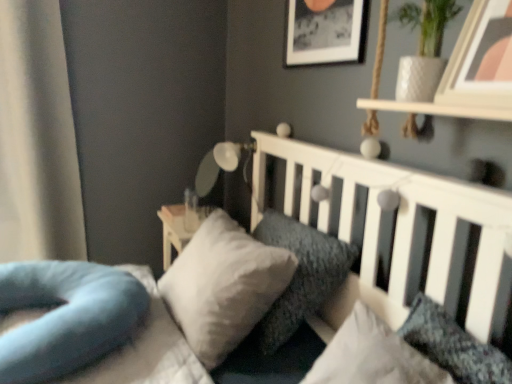
What is the approximate width of white soft bed at center?

The width of white soft bed at center is 1.18 meters.

Image resolution: width=512 pixels, height=384 pixels. What do you see at coordinates (400, 231) in the screenshot?
I see `white soft bed at center` at bounding box center [400, 231].

Consider the image. How much space does black matte picture frame at upper center, the second picture frame in the bottom-to-top sequence, occupy vertically?

black matte picture frame at upper center, the second picture frame in the bottom-to-top sequence, is 11.04 inches in height.

At what (x,y) coordinates should I click in order to perform the action: click on wooden picture frame at upper right, arranged as the second picture frame when viewed from the top. Please return your answer as a coordinate pair (x, y). The height and width of the screenshot is (384, 512). Looking at the image, I should click on (481, 59).

In order to click on textured gray pillow at center, the 4th pillow from the left in this screenshot , I will do `click(372, 356)`.

Describe the element at coordinates (372, 356) in the screenshot. I see `textured gray pillow at center, the 4th pillow from the left` at that location.

This screenshot has width=512, height=384. Identify the location of soft blue pillow at lower left, which appears as the first pillow when viewed from the left. (66, 316).

Where is `white soft bed at center`? Image resolution: width=512 pixels, height=384 pixels. white soft bed at center is located at coordinates (400, 231).

Considering the sizes of wooden picture frame at upper right, which is the 1th picture frame in right-to-left order, and soft blue pillow at lower left, the 4th pillow viewed from the right, in the image, is wooden picture frame at upper right, which is the 1th picture frame in right-to-left order, wider or thinner than soft blue pillow at lower left, the 4th pillow viewed from the right,?

Clearly, wooden picture frame at upper right, which is the 1th picture frame in right-to-left order, has less width compared to soft blue pillow at lower left, the 4th pillow viewed from the right.

Is wooden picture frame at upper right, arranged as the second picture frame when viewed from the top, closer to the viewer compared to soft blue pillow at lower left, the 4th pillow viewed from the right?

Yes, wooden picture frame at upper right, arranged as the second picture frame when viewed from the top, is in front of soft blue pillow at lower left, the 4th pillow viewed from the right.

How different are the orientations of wooden picture frame at upper right, which appears as the second picture frame when viewed from the back, and soft blue pillow at lower left, which appears as the first pillow when viewed from the left, in degrees?

They differ by 1.51 degrees in their facing directions.

From their relative heights in the image, would you say wooden picture frame at upper right, marked as the second picture frame in a left-to-right arrangement, is taller or shorter than soft blue pillow at lower left, which appears as the first pillow when viewed from the left?

Clearly, wooden picture frame at upper right, marked as the second picture frame in a left-to-right arrangement, is taller compared to soft blue pillow at lower left, which appears as the first pillow when viewed from the left.

Is white soft pillow at center, the second pillow positioned from the left, next to white glossy lamp at upper center and touching it?

No.

From a real-world perspective, between white soft pillow at center, the second pillow positioned from the left, and white glossy lamp at upper center, who is vertically lower?

white soft pillow at center, the second pillow positioned from the left, from a real-world perspective.

Can you confirm if white glossy lamp at upper center is smaller than white soft pillow at center, which appears as the third pillow when viewed from the right?

Yes.

What's the angular difference between white glossy lamp at upper center and white soft pillow at center, which appears as the third pillow when viewed from the right,'s facing directions?

There is a 1.92-degree angle between the facing directions of white glossy lamp at upper center and white soft pillow at center, which appears as the third pillow when viewed from the right.

Does point (222, 162) appear closer or farther from the camera than point (231, 318)?

Point (222, 162) is farther from the camera than point (231, 318).

Could you tell me if white glossy lamp at upper center is turned towards white soft pillow at center, which appears as the third pillow when viewed from the right?

No.

Would you say wooden picture frame at upper right, arranged as the second picture frame when viewed from the top, is part of textured gray pillow at center, the 4th pillow from the left,'s contents?

No, wooden picture frame at upper right, arranged as the second picture frame when viewed from the top, is located outside of textured gray pillow at center, the 4th pillow from the left.

How different are the orientations of textured gray pillow at center, the 4th pillow from the left, and wooden picture frame at upper right, the 1th picture frame when ordered from bottom to top, in degrees?

The facing directions of textured gray pillow at center, the 4th pillow from the left, and wooden picture frame at upper right, the 1th picture frame when ordered from bottom to top, are 2.97 degrees apart.

Consider the image. Which object is further away from the camera, textured gray pillow at center, positioned as the 1th pillow in right-to-left order, or wooden picture frame at upper right, which appears as the second picture frame when viewed from the back?

wooden picture frame at upper right, which appears as the second picture frame when viewed from the back, is further from the camera.

In terms of height, does textured gray pillow at center, positioned as the 1th pillow in right-to-left order, look taller or shorter compared to wooden picture frame at upper right, arranged as the second picture frame when viewed from the top?

In the image, textured gray pillow at center, positioned as the 1th pillow in right-to-left order, appears to be taller than wooden picture frame at upper right, arranged as the second picture frame when viewed from the top.

The height and width of the screenshot is (384, 512). What are the coordinates of `the 1st picture frame to the right of the soft gray pillow at center, which is counted as the 2th pillow, starting from the right, starting your count from the anchor` in the screenshot? It's located at (324, 31).

Is black matte picture frame at upper center, which is the first picture frame from back to front, with soft gray pillow at center, arranged as the 3th pillow when viewed from the left?

No, black matte picture frame at upper center, which is the first picture frame from back to front, is not touching soft gray pillow at center, arranged as the 3th pillow when viewed from the left.

Looking at this image, does black matte picture frame at upper center, the first picture frame positioned from the top, have a greater width compared to soft gray pillow at center, arranged as the 3th pillow when viewed from the left?

Incorrect, the width of black matte picture frame at upper center, the first picture frame positioned from the top, does not surpass that of soft gray pillow at center, arranged as the 3th pillow when viewed from the left.

Can you confirm if white soft pillow at center, which appears as the third pillow when viewed from the right, is thinner than soft blue pillow at lower left, which appears as the first pillow when viewed from the left?

Yes.

Considering the sizes of objects white soft pillow at center, the second pillow positioned from the left, and soft blue pillow at lower left, which appears as the first pillow when viewed from the left, in the image provided, who is bigger, white soft pillow at center, the second pillow positioned from the left, or soft blue pillow at lower left, which appears as the first pillow when viewed from the left,?

Bigger between the two is white soft pillow at center, the second pillow positioned from the left.

From a real-world perspective, is white soft pillow at center, which appears as the third pillow when viewed from the right, located beneath soft blue pillow at lower left, which appears as the first pillow when viewed from the left?

No, from a real-world perspective, white soft pillow at center, which appears as the third pillow when viewed from the right, is not below soft blue pillow at lower left, which appears as the first pillow when viewed from the left.

From the image's perspective, who appears lower, white soft pillow at center, the second pillow positioned from the left, or soft blue pillow at lower left, the 4th pillow viewed from the right?

soft blue pillow at lower left, the 4th pillow viewed from the right, is shown below in the image.

Is white glossy lamp at upper center aimed at wooden picture frame at upper right, arranged as the second picture frame when viewed from the top?

No, white glossy lamp at upper center is not aimed at wooden picture frame at upper right, arranged as the second picture frame when viewed from the top.

Considering the relative sizes of white glossy lamp at upper center and wooden picture frame at upper right, the 1th picture frame when ordered from bottom to top, in the image provided, is white glossy lamp at upper center smaller than wooden picture frame at upper right, the 1th picture frame when ordered from bottom to top,?

No, white glossy lamp at upper center is not smaller than wooden picture frame at upper right, the 1th picture frame when ordered from bottom to top.

How distant is white glossy lamp at upper center from wooden picture frame at upper right, positioned as the first picture frame in front-to-back order?

white glossy lamp at upper center is 4.27 feet away from wooden picture frame at upper right, positioned as the first picture frame in front-to-back order.

You are a GUI agent. You are given a task and a screenshot of the screen. Output one action in this format:
    pyautogui.click(x=<x>, y=<y>)
    Task: Click on the 2nd picture frame to the right of the soft blue pillow at lower left, which appears as the first pillow when viewed from the left, starting your count from the anchor
    
    Given the screenshot: What is the action you would take?
    pyautogui.click(x=481, y=59)

At what (x,y) coordinates should I click in order to perform the action: click on lamp above the white soft pillow at center, which appears as the third pillow when viewed from the right (from the image's perspective). Please return your answer as a coordinate pair (x, y). The height and width of the screenshot is (384, 512). Looking at the image, I should click on (233, 156).

Estimate the real-world distances between objects in this image. Which object is further from black matte picture frame at upper center, the first picture frame positioned from the top, soft blue pillow at lower left, which appears as the first pillow when viewed from the left, or white glossy lamp at upper center?

Based on the image, soft blue pillow at lower left, which appears as the first pillow when viewed from the left, appears to be further to black matte picture frame at upper center, the first picture frame positioned from the top.

Looking at the image, which one is located closer to white soft pillow at center, which appears as the third pillow when viewed from the right, wooden picture frame at upper right, which is the 1th picture frame in right-to-left order, or soft blue pillow at lower left, which appears as the first pillow when viewed from the left?

soft blue pillow at lower left, which appears as the first pillow when viewed from the left, is closer to white soft pillow at center, which appears as the third pillow when viewed from the right.

Estimate the real-world distances between objects in this image. Which object is closer to soft gray pillow at center, which is counted as the 2th pillow, starting from the right, soft blue pillow at lower left, which appears as the first pillow when viewed from the left, or white soft bed at center?

white soft bed at center is closer to soft gray pillow at center, which is counted as the 2th pillow, starting from the right.

When comparing their distances from soft blue pillow at lower left, which appears as the first pillow when viewed from the left, does textured gray pillow at center, the 4th pillow from the left, or white glossy lamp at upper center seem further?

white glossy lamp at upper center is further to soft blue pillow at lower left, which appears as the first pillow when viewed from the left.

From the image, which object appears to be farther from wooden picture frame at upper right, the 1th picture frame when ordered from bottom to top, white soft bed at center or white glossy lamp at upper center?

Based on the image, white glossy lamp at upper center appears to be further to wooden picture frame at upper right, the 1th picture frame when ordered from bottom to top.

Based on their spatial positions, is soft gray pillow at center, arranged as the 3th pillow when viewed from the left, or white soft pillow at center, which appears as the third pillow when viewed from the right, further from white glossy lamp at upper center?

white soft pillow at center, which appears as the third pillow when viewed from the right, is further to white glossy lamp at upper center.

Based on their spatial positions, is wooden picture frame at upper right, arranged as the second picture frame when viewed from the top, or textured gray pillow at center, positioned as the 1th pillow in right-to-left order, further from white soft bed at center?

Based on the image, wooden picture frame at upper right, arranged as the second picture frame when viewed from the top, appears to be further to white soft bed at center.

Considering their positions, is soft gray pillow at center, which is counted as the 2th pillow, starting from the right, positioned closer to white glossy lamp at upper center than wooden picture frame at upper right, which appears as the second picture frame when viewed from the back?

Based on the image, soft gray pillow at center, which is counted as the 2th pillow, starting from the right, appears to be nearer to white glossy lamp at upper center.

At what (x,y) coordinates should I click in order to perform the action: click on bed between soft blue pillow at lower left, which appears as the first pillow when viewed from the left, and wooden picture frame at upper right, which appears as the second picture frame when viewed from the back, in the horizontal direction. Please return your answer as a coordinate pair (x, y). The height and width of the screenshot is (384, 512). Looking at the image, I should click on (400, 231).

The image size is (512, 384). Identify the location of lamp that lies between black matte picture frame at upper center, positioned as the second picture frame in right-to-left order, and soft gray pillow at center, which is counted as the 2th pillow, starting from the right, from top to bottom. (233, 156).

Where is `pillow between black matte picture frame at upper center, the 1th picture frame when ordered from left to right, and white soft pillow at center, the second pillow positioned from the left, from top to bottom`? The image size is (512, 384). pillow between black matte picture frame at upper center, the 1th picture frame when ordered from left to right, and white soft pillow at center, the second pillow positioned from the left, from top to bottom is located at coordinates (300, 275).

The width and height of the screenshot is (512, 384). I want to click on bed between soft blue pillow at lower left, the 4th pillow viewed from the right, and textured gray pillow at center, the 4th pillow from the left, so click(400, 231).